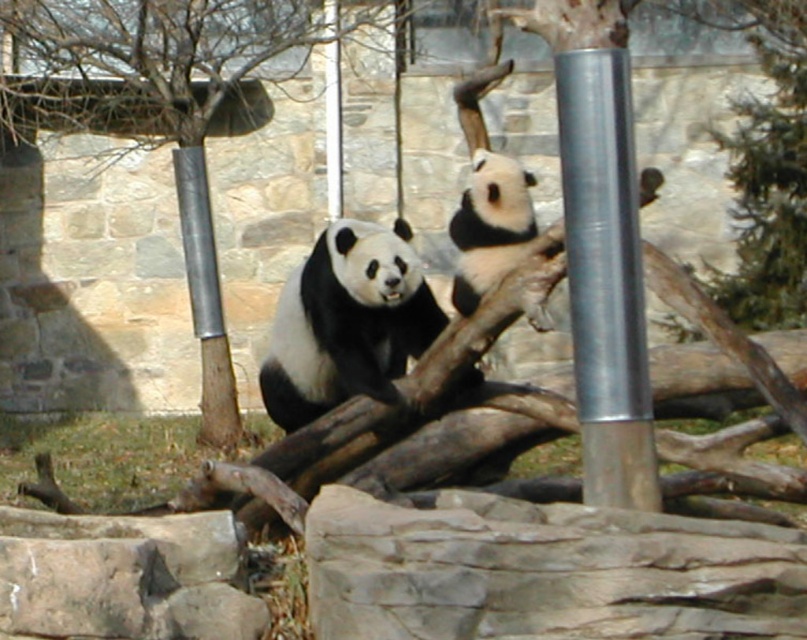
Who is positioned more to the right, black and white fur at upper center or silver metallic pole at center?

Positioned to the right is black and white fur at upper center.

At what (x,y) coordinates should I click in order to perform the action: click on black and white fur at upper center. Please return your answer as a coordinate pair (x, y). Looking at the image, I should click on (488, 225).

Does smooth bark tree at upper left have a greater width compared to green textured tree at upper right?

Yes.

Between smooth bark tree at upper left and green textured tree at upper right, which one appears on the left side from the viewer's perspective?

smooth bark tree at upper left is more to the left.

The image size is (807, 640). What do you see at coordinates (157, 61) in the screenshot?
I see `smooth bark tree at upper left` at bounding box center [157, 61].

What are the coordinates of `smooth bark tree at upper left` in the screenshot? It's located at click(x=157, y=61).

Does brushed metal tree at center have a smaller size compared to smooth bark tree at upper left?

Actually, brushed metal tree at center might be larger than smooth bark tree at upper left.

Is point (241, 97) farther from camera compared to point (6, 20)?

Yes, it is.

Is point (141, 118) more distant than point (216, 84)?

Yes, point (141, 118) is farther from viewer.

Identify the location of brushed metal tree at center. (165, 108).